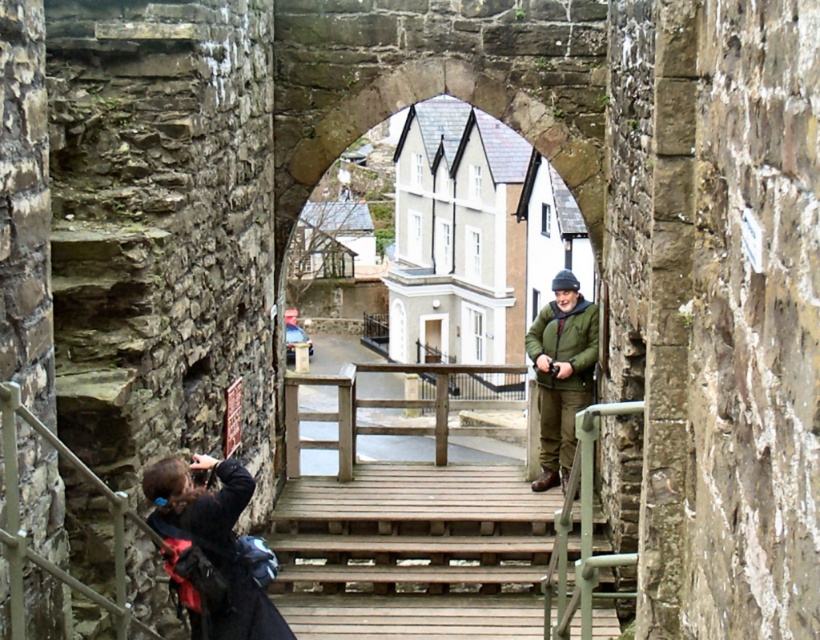
You are a delivery person carrying a package and need to walk from the dark blue fabric at lower left to the green matte jacket at center. Given that the path between them is 10.43 meters, will you be able to walk straight through the path without any obstacles?

The path between the dark blue fabric at lower left and the green matte jacket at center is 10.43 meters long. Since there are no obstacles mentioned in the scene description, you can walk straight through the path without any issues.